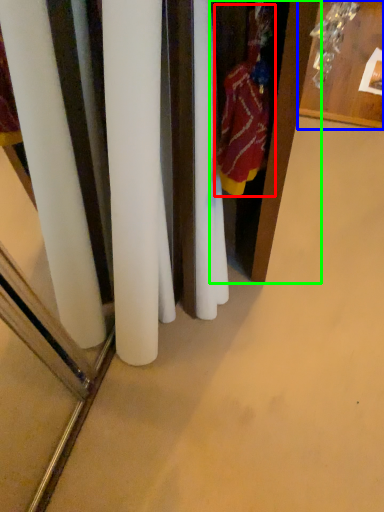
Question: Which object is the farthest from clothing (highlighted by a red box)? Choose among these: furniture (highlighted by a blue box) or armoire (highlighted by a green box).

Choices:
 (A) furniture
 (B) armoire

Answer: (A)